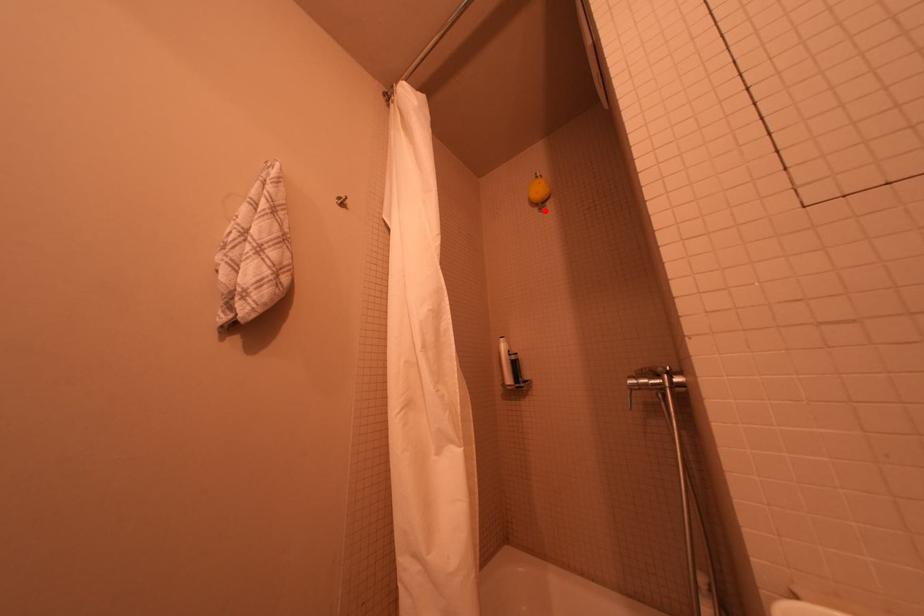
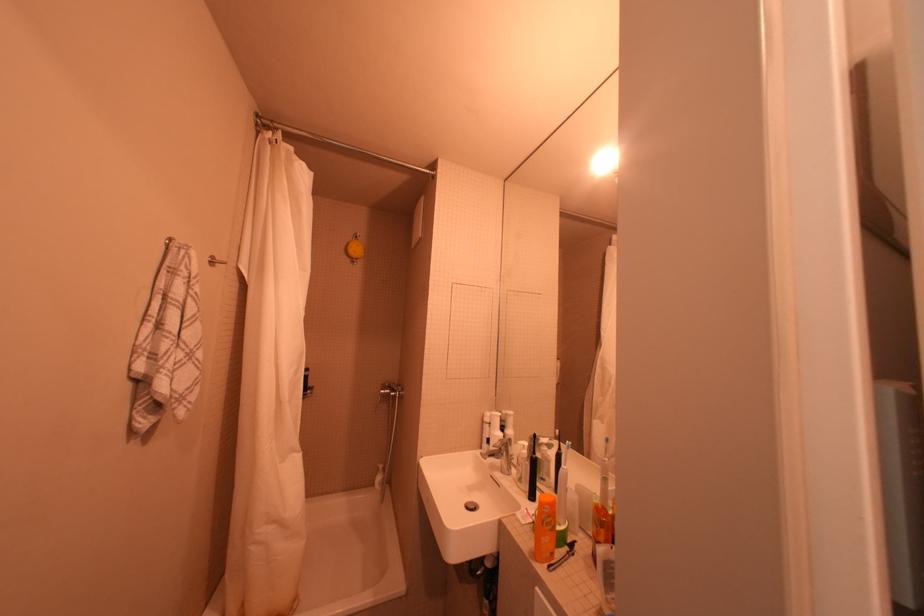
Where in the second image is the point corresponding to the highlighted location from the first image?

(358, 261)